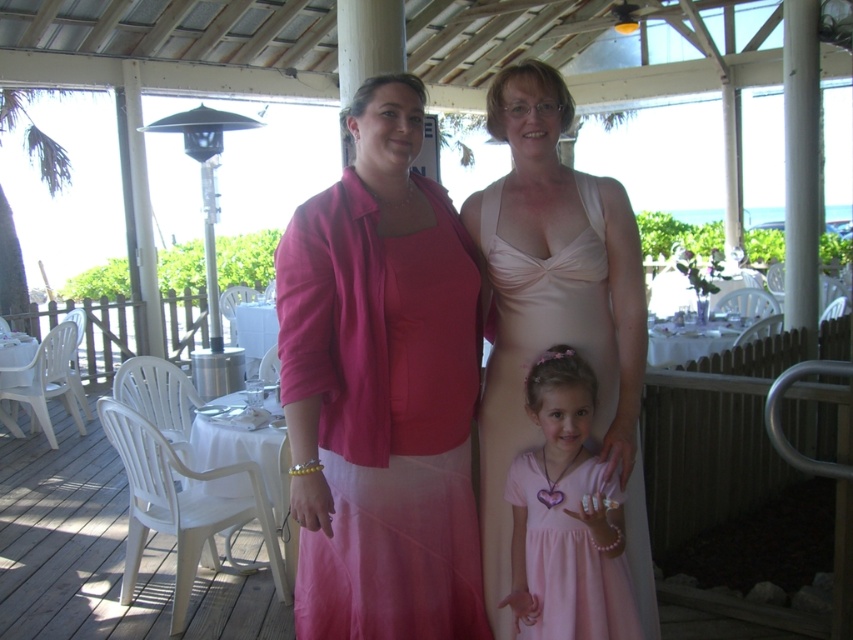
Question: Is matte pink dress at center above pink satin dress at center?

Choices:
 (A) no
 (B) yes

Answer: (B)

Question: Is satin beige dress at center thinner than pink satin dress at center?

Choices:
 (A) yes
 (B) no

Answer: (B)

Question: Can you confirm if matte pink dress at center is bigger than satin beige dress at center?

Choices:
 (A) yes
 (B) no

Answer: (B)

Question: Which point is farther to the camera?

Choices:
 (A) pink satin dress at center
 (B) matte pink dress at center
 (C) satin beige dress at center

Answer: (C)

Question: Which of the following is the closest to the observer?

Choices:
 (A) (358, 362)
 (B) (641, 548)
 (C) (576, 609)

Answer: (A)

Question: Which point is farther from the camera taking this photo?

Choices:
 (A) (326, 246)
 (B) (525, 616)

Answer: (B)